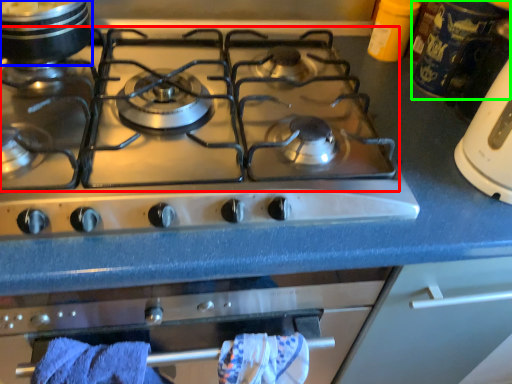
Question: Which object is positioned closest to gas stove (highlighted by a red box)? Select from kitchen appliance (highlighted by a blue box) and appliance (highlighted by a green box).

Choices:
 (A) kitchen appliance
 (B) appliance

Answer: (A)